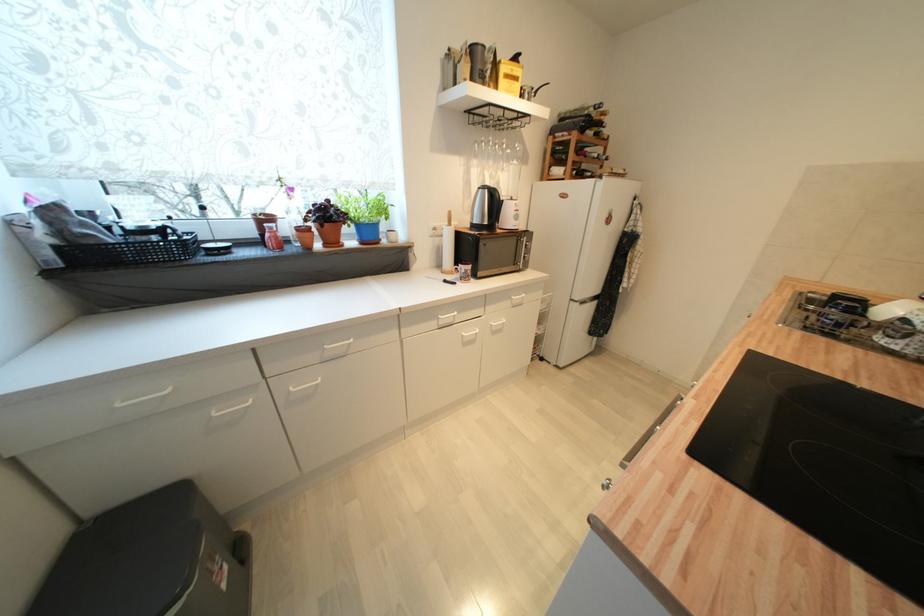
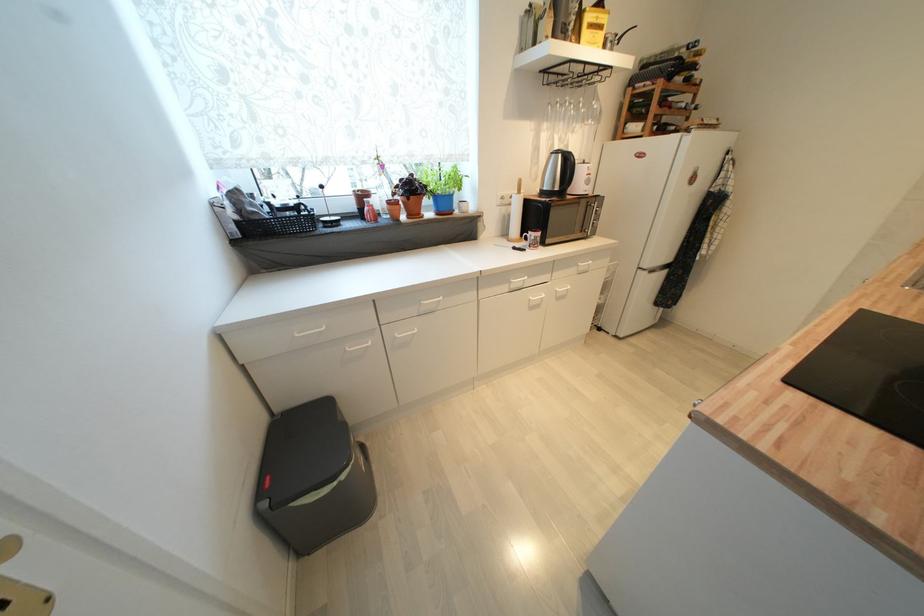
The point at (513, 150) is marked in the first image. Where is the corresponding point in the second image?

(589, 108)